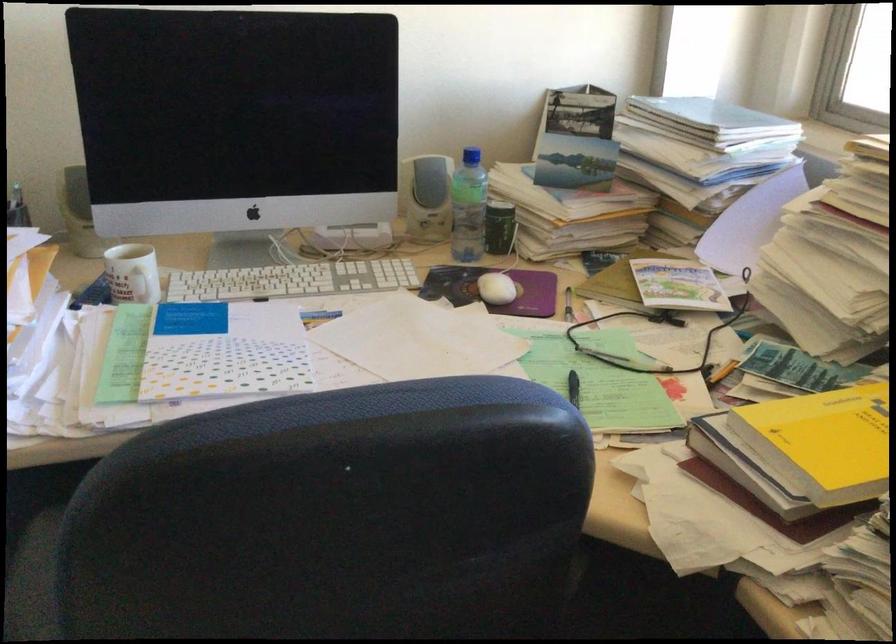
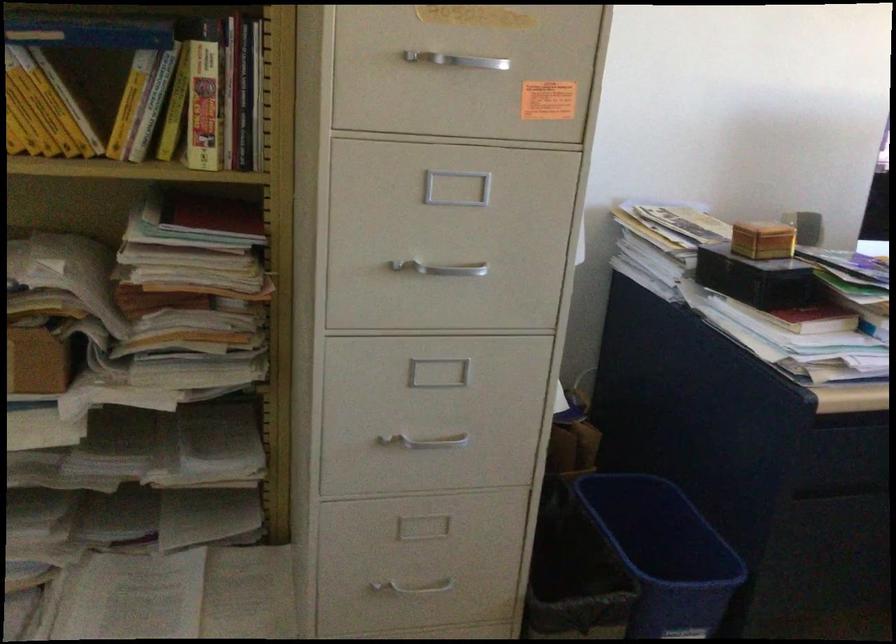
Which direction would the cameraman need to move to produce the second image?

The cameraman moved toward left, backward.